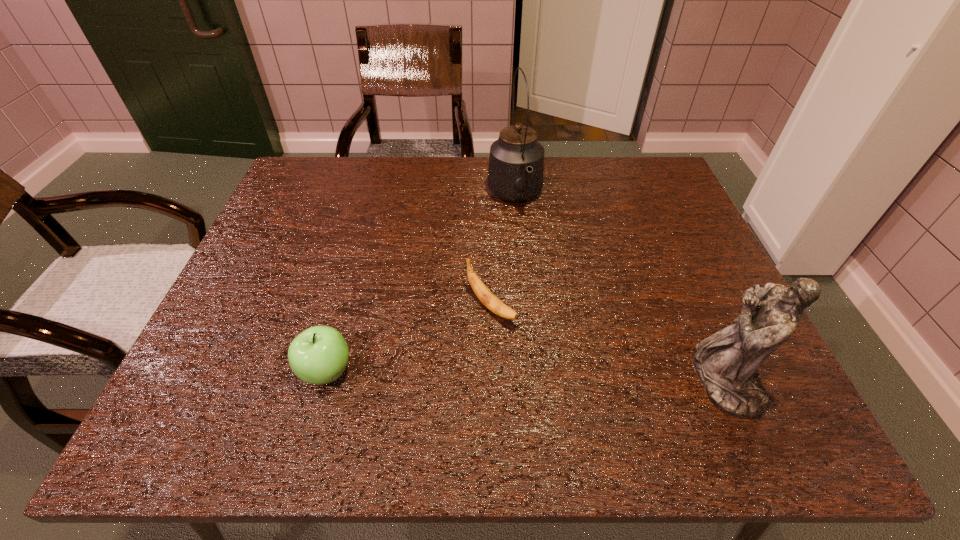
This screenshot has height=540, width=960. Find the location of `vacant space at the near right corner of the desktop`. vacant space at the near right corner of the desktop is located at coordinates (766, 383).

Identify the location of vacant area that lies between the rightmost object and the tallest object. The width and height of the screenshot is (960, 540). (619, 288).

You are a GUI agent. You are given a task and a screenshot of the screen. Output one action in this format:
    pyautogui.click(x=<x>, y=<y>)
    Task: Click on the free space between the figurine and the apple
    The image size is (960, 540).
    Given the screenshot: What is the action you would take?
    pyautogui.click(x=525, y=376)

The width and height of the screenshot is (960, 540). I want to click on vacant area that lies between the rightmost object and the leftmost object, so click(x=525, y=376).

Locate an element on the screen. vacant area that lies between the banana and the figurine is located at coordinates [x=608, y=343].

Find the location of `unoccupied area between the tallest object and the banana`. unoccupied area between the tallest object and the banana is located at coordinates (503, 252).

Locate an element on the screen. The height and width of the screenshot is (540, 960). free space between the rightmost object and the banana is located at coordinates (608, 343).

Locate an element on the screen. vacant space that's between the banana and the kettle is located at coordinates (503, 252).

What are the coordinates of `unoccupied position between the banana and the second tallest object` in the screenshot? It's located at (608, 343).

This screenshot has height=540, width=960. Identify the location of vacant region between the second shortest object and the figurine. (525, 376).